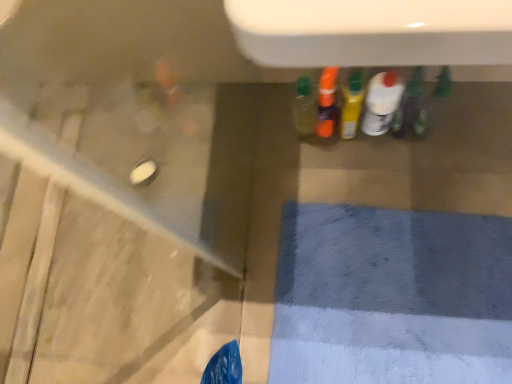
Find the location of a particular element. vacant region to the left of white glossy bottle at center, the second bottle positioned from the right is located at coordinates (331, 161).